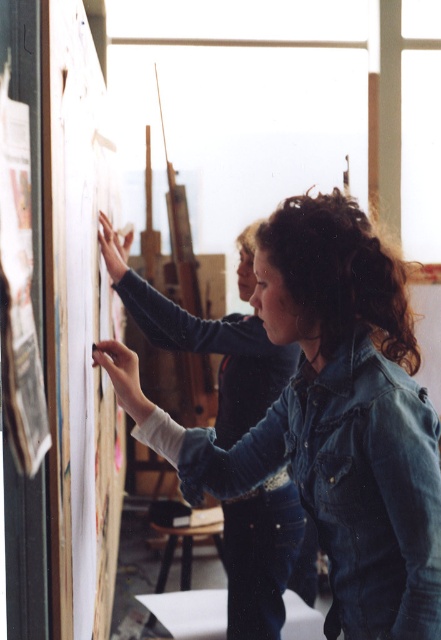
You are standing in an art studio and see two points marked on the board. The first point is labeled as point (388, 529) and the second is point (55, 209). According to the scene description, which point is closer to the viewer?

Point (55, 209) is closer to the viewer because the description states that point (388, 529) is behind point (55, 209).

You are an artist standing in the studio and need to place a 12 inch ruler between the wooden board at left and the denim jacket at upper center. Will the ruler fit between them without overlapping either object?

The wooden board at left and denim jacket at upper center are 16.77 inches apart from each other, so a 12 inch ruler can fit between them without overlapping either object since 12 is less than 16.77.